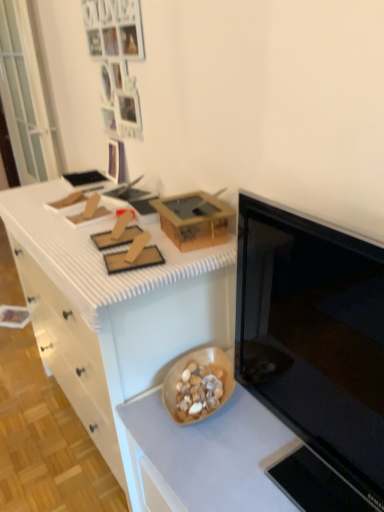
Find the location of a particular element. free location above white textured countertop at upper left, the 2th countertop positioned from the bottom (from a real-world perspective) is located at coordinates (76, 226).